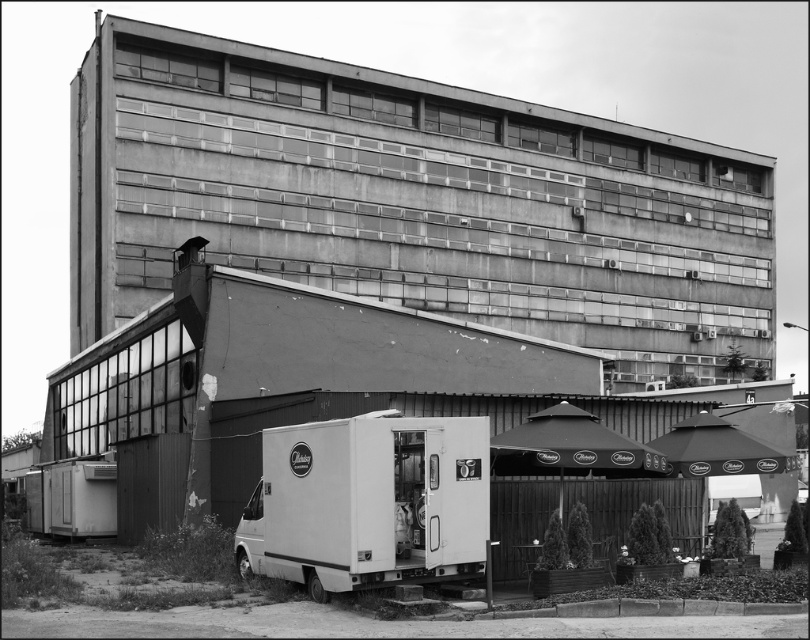
You are a delivery person trying to park your van between the white matte food truck at lower center and the metallic trailer at lower left. Can you park your van there if the space between them is wide enough for your van?

The white matte food truck at lower center is in front of the metallic trailer at lower left, so there is no space between them for parking. You cannot park your van there.

Based on the photo, you are a delivery driver who needs to park your truck, which is 20 feet long, between the white matte food truck at lower center and the metallic trailer at lower left. Can you fit your truck in that space?

The distance between the white matte food truck at lower center and the metallic trailer at lower left is 77.63 feet. Since your truck is only 20 feet long, there is more than enough space to park it between them.